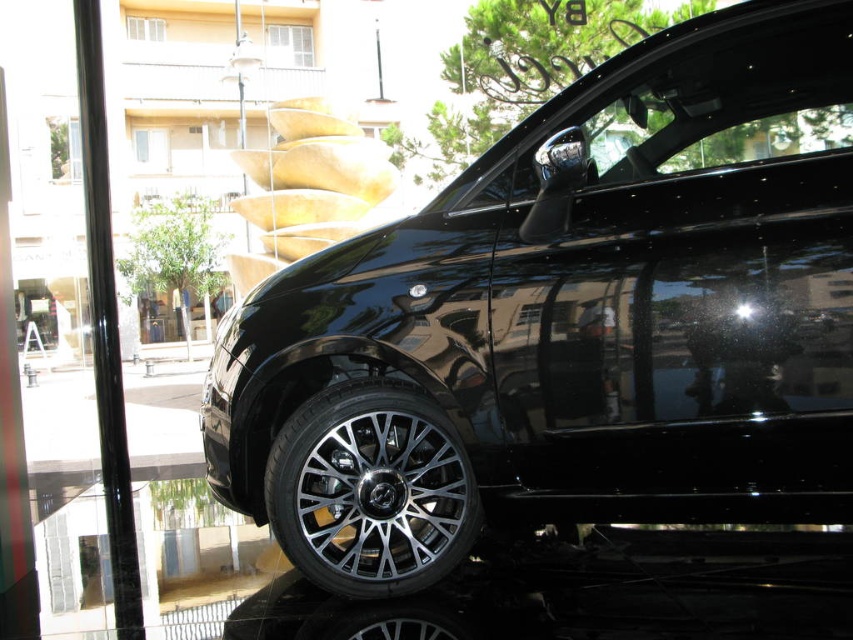
Question: Can you confirm if glossy black car at center is smaller than transparent glass door at left?

Choices:
 (A) yes
 (B) no

Answer: (A)

Question: Can you confirm if transparent glass door at left is positioned below black polished wheel at lower center?

Choices:
 (A) yes
 (B) no

Answer: (B)

Question: Which object is positioned farthest from the black polished wheel at lower center?

Choices:
 (A) glossy black car at center
 (B) transparent glass door at left

Answer: (B)

Question: Among these objects, which one is nearest to the camera?

Choices:
 (A) black polished wheel at lower center
 (B) transparent glass door at left
 (C) glossy black car at center
 (D) polished silver wheel at lower center

Answer: (C)

Question: Is transparent glass door at left to the right of polished silver wheel at lower center from the viewer's perspective?

Choices:
 (A) yes
 (B) no

Answer: (B)

Question: Estimate the real-world distances between objects in this image. Which object is farther from the black polished wheel at lower center?

Choices:
 (A) glossy black car at center
 (B) transparent glass door at left

Answer: (B)